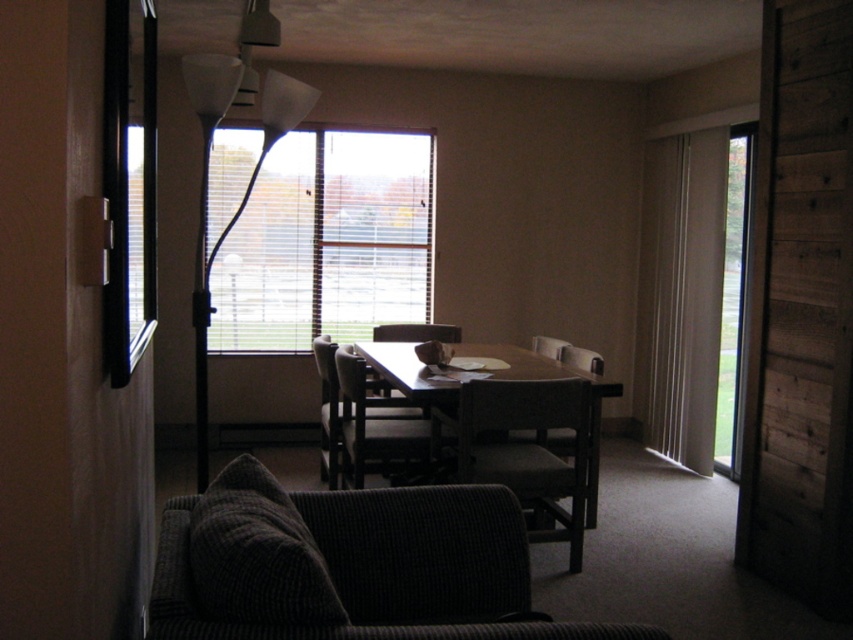
Is white blinds at center positioned in front of wooden chair at center?

No, it is not.

Which is more to the left, white blinds at center or wooden chair at center?

Positioned to the left is white blinds at center.

Does point (242, 323) lie behind point (340, 353)?

Yes.

Find the location of a particular element. The image size is (853, 640). white blinds at center is located at coordinates pos(328,243).

Which of these two, wooden chair at center or wooden dining chair at center, stands shorter?

With less height is wooden dining chair at center.

Is wooden chair at center positioned before wooden dining chair at center?

Yes, it is in front of wooden dining chair at center.

Between point (387, 467) and point (392, 339), which one is positioned behind?

Point (392, 339)

The width and height of the screenshot is (853, 640). In order to click on wooden chair at center in this screenshot , I will do `click(376, 424)`.

Can you confirm if wooden table at center is shorter than wooden dining chair at center?

Incorrect, wooden table at center's height does not fall short of wooden dining chair at center's.

Describe the element at coordinates (552, 378) in the screenshot. I see `wooden table at center` at that location.

The width and height of the screenshot is (853, 640). What are the coordinates of `wooden table at center` in the screenshot? It's located at (552, 378).